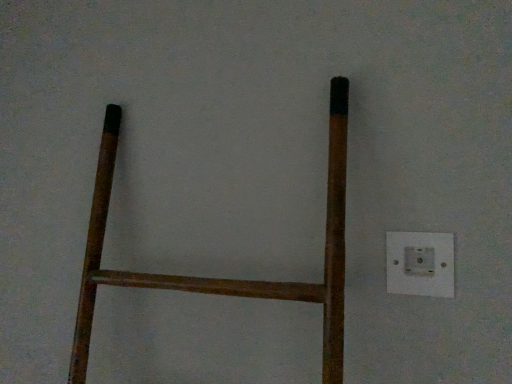
Question: Should I look upward or downward to see white plastic power plugs and sockets at right?

Choices:
 (A) up
 (B) down

Answer: (B)